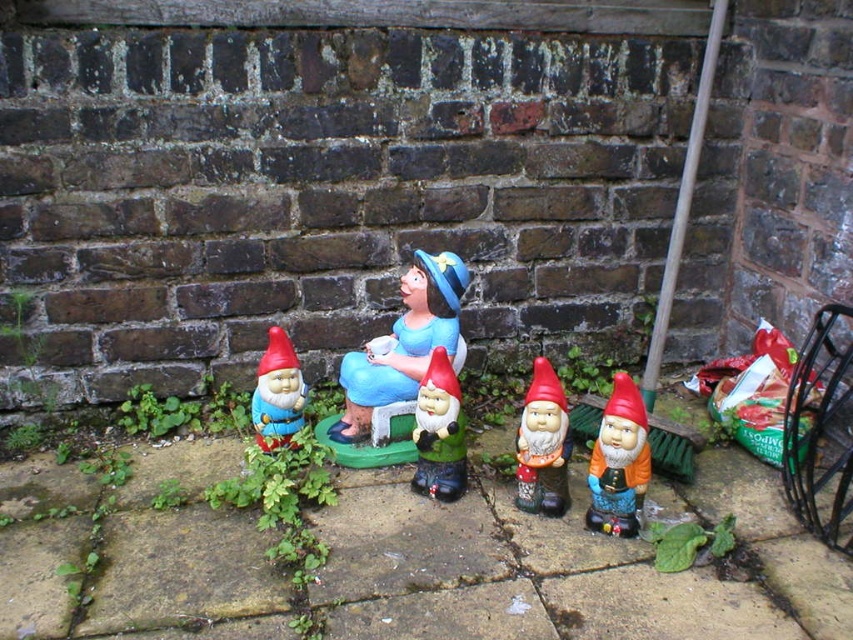
Looking at this image, who is more forward, (341, 438) or (282, 440)?

Positioned in front is point (282, 440).

This screenshot has width=853, height=640. Describe the element at coordinates (403, 342) in the screenshot. I see `matte ceramic figure at center` at that location.

The image size is (853, 640). Describe the element at coordinates (403, 342) in the screenshot. I see `matte ceramic figure at center` at that location.

You are a GUI agent. You are given a task and a screenshot of the screen. Output one action in this format:
    pyautogui.click(x=<x>, y=<y>)
    Task: Click on the matte ceramic figure at center
    
    Given the screenshot: What is the action you would take?
    pyautogui.click(x=403, y=342)

Who is positioned more to the left, matte plastic gnome at center or matte plastic gnome at left?

From the viewer's perspective, matte plastic gnome at left appears more on the left side.

Does matte plastic gnome at center have a lesser height compared to matte plastic gnome at left?

Incorrect, matte plastic gnome at center's height does not fall short of matte plastic gnome at left's.

Is point (535, 422) farther from camera compared to point (285, 410)?

That is False.

Locate an element on the screen. matte plastic gnome at center is located at coordinates (543, 444).

What do you see at coordinates (403, 342) in the screenshot?
I see `matte ceramic figure at center` at bounding box center [403, 342].

Can you confirm if matte ceramic figure at center is positioned below green matte gnome at center?

Incorrect, matte ceramic figure at center is not positioned below green matte gnome at center.

Find the location of `matte ceramic figure at center`. matte ceramic figure at center is located at coordinates (403, 342).

Find the location of a particular element. matte ceramic figure at center is located at coordinates (403, 342).